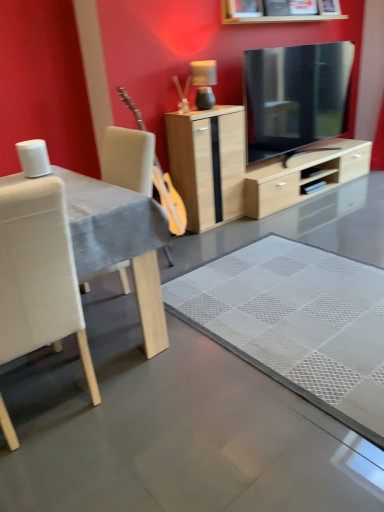
Question: From the image's perspective, is white fabric chair at left positioned above or below light wood/glossy cabinet at center?

Choices:
 (A) below
 (B) above

Answer: (A)

Question: In terms of height, does white fabric chair at left look taller or shorter compared to light wood/glossy cabinet at center?

Choices:
 (A) tall
 (B) short

Answer: (A)

Question: Which object is the closest to the white fabric chair at left?

Choices:
 (A) white fabric table at left
 (B) light wood/glossy cabinet at center
 (C) matte gray lamp at center

Answer: (A)

Question: Which of these objects is positioned farthest from the white fabric chair at left?

Choices:
 (A) light wood/glossy cabinet at center
 (B) white fabric table at left
 (C) matte gray lamp at center

Answer: (C)